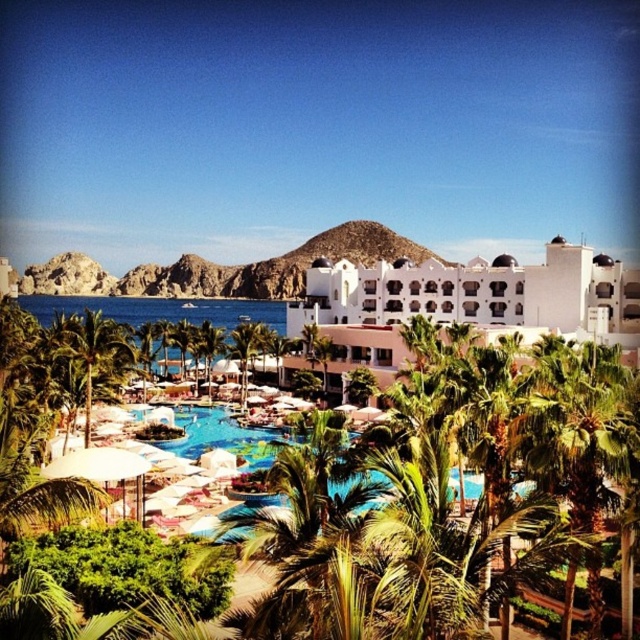
Is white matte building at center smaller than green leafy palm tree at center?

Incorrect, white matte building at center is not smaller in size than green leafy palm tree at center.

Is white matte building at center closer to camera compared to green leafy palm tree at center?

Yes, white matte building at center is closer to the viewer.

Is point (468, 314) positioned behind point (243, 404)?

Yes, point (468, 314) is behind point (243, 404).

Where is `white matte building at center`? white matte building at center is located at coordinates (467, 301).

What do you see at coordinates (467, 301) in the screenshot?
I see `white matte building at center` at bounding box center [467, 301].

Is point (480, 278) positioned before point (81, 324)?

That is False.

This screenshot has height=640, width=640. What do you see at coordinates (467, 301) in the screenshot?
I see `white matte building at center` at bounding box center [467, 301].

The image size is (640, 640). Find the location of `white matte building at center`. white matte building at center is located at coordinates (467, 301).

Which is above, green leafy palm tree at lower left or green leafy palm tree at center?

green leafy palm tree at center is higher up.

Between green leafy palm tree at lower left and green leafy palm tree at center, which one appears on the right side from the viewer's perspective?

From the viewer's perspective, green leafy palm tree at center appears more on the right side.

Does point (124, 346) come in front of point (232, 339)?

Yes.

Where is `green leafy palm tree at lower left`? The height and width of the screenshot is (640, 640). green leafy palm tree at lower left is located at coordinates (93, 349).